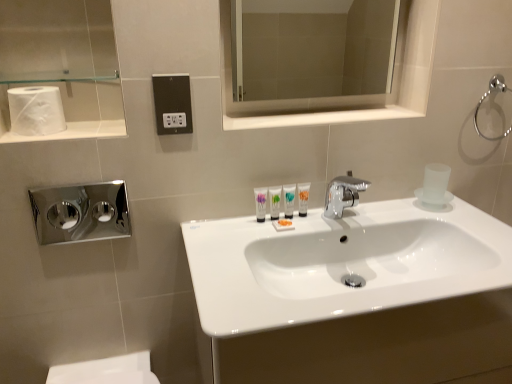
At what (x,y) coordinates should I click in order to perform the action: click on vacant point to the right of white glossy tube at center, which ranks as the first toiletry in right-to-left order. Please return your answer as a coordinate pair (x, y). The image size is (512, 384). Looking at the image, I should click on (330, 220).